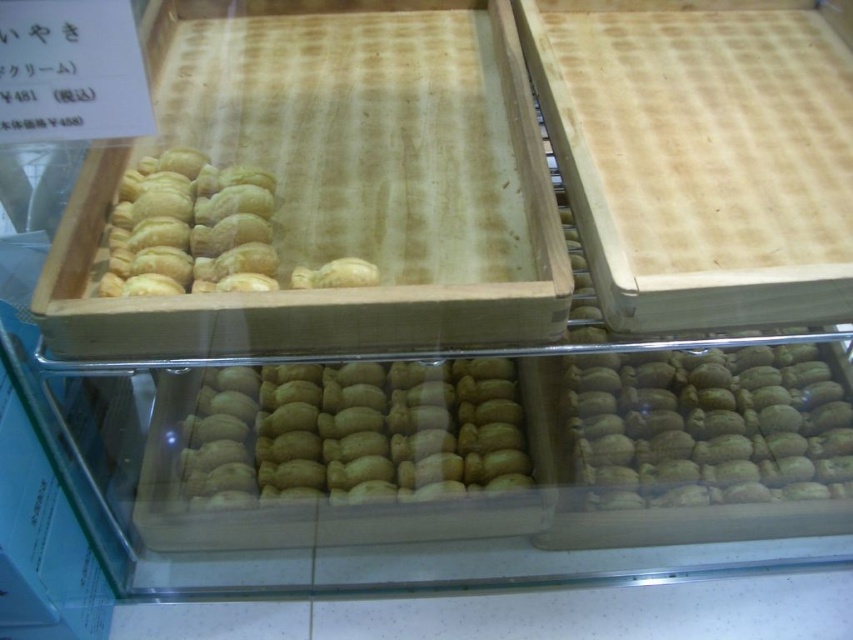
Which is in front, point (619, 499) or point (141, 200)?

Positioned in front is point (141, 200).

Is point (849, 490) positioned after point (183, 282)?

Yes, it is.

Is point (717, 381) farther from camera compared to point (228, 168)?

Yes, it is behind point (228, 168).

Where is `golden matte cream puff at center`? The width and height of the screenshot is (853, 640). golden matte cream puff at center is located at coordinates (708, 426).

Who is more forward, (x=502, y=376) or (x=773, y=412)?

Point (x=773, y=412) is in front.

Between golden matte pastry at center and golden matte cream puff at center, which one appears on the left side from the viewer's perspective?

From the viewer's perspective, golden matte pastry at center appears more on the left side.

Image resolution: width=853 pixels, height=640 pixels. Find the location of `golden matte pastry at center`. golden matte pastry at center is located at coordinates (354, 433).

Does point (520, 472) lie behind point (136, 234)?

Yes, it is behind point (136, 234).

Which of these two, golden matte pastry at center or golden brown doughnut at upper left, stands shorter?

With less height is golden brown doughnut at upper left.

Identify the location of golden matte pastry at center. The width and height of the screenshot is (853, 640). tap(354, 433).

Find the location of a particular element. golden matte pastry at center is located at coordinates (354, 433).